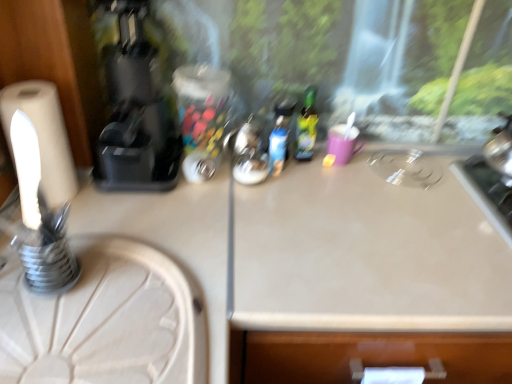
Question: From the image's perspective, is black plastic coffee machine at left positioned above or below white wood round table at lower left?

Choices:
 (A) below
 (B) above

Answer: (B)

Question: In the image, is black plastic coffee machine at left on the left side or the right side of white wood round table at lower left?

Choices:
 (A) left
 (B) right

Answer: (B)

Question: Estimate the real-world distances between objects in this image. Which object is closer to the white matte toilet paper at left?

Choices:
 (A) black plastic coffee machine at left
 (B) white wood round table at lower left
 (C) matte plastic bottle at center, which is the 2th bottle from right to left
 (D) beige laminate counter top at center
 (E) green glass bottle at center, which is counted as the first bottle, starting from the right

Answer: (A)

Question: Which object is the closest to the white wood round table at lower left?

Choices:
 (A) matte plastic bottle at center, which is the 2th bottle from right to left
 (B) green glass bottle at center, the second bottle positioned from the left
 (C) black plastic coffee machine at left
 (D) beige laminate counter top at center
 (E) white matte toilet paper at left

Answer: (E)